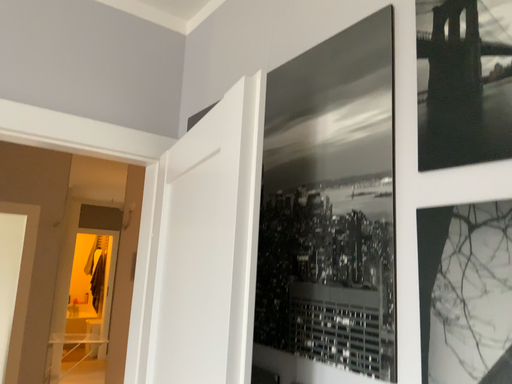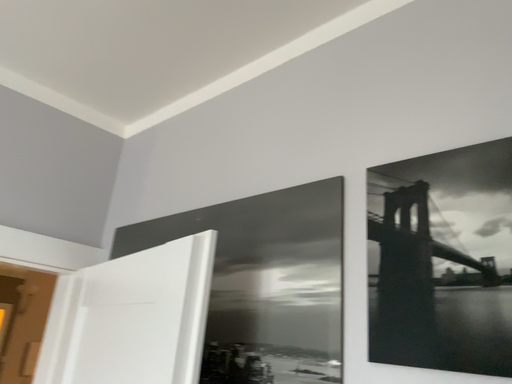
Question: How did the camera likely rotate when shooting the video?

Choices:
 (A) rotated downward
 (B) rotated upward

Answer: (B)